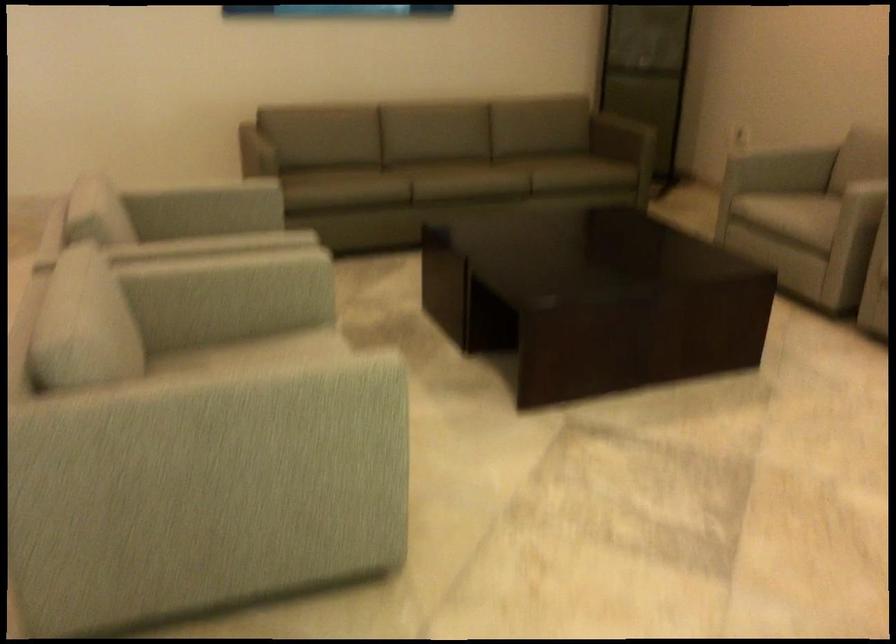
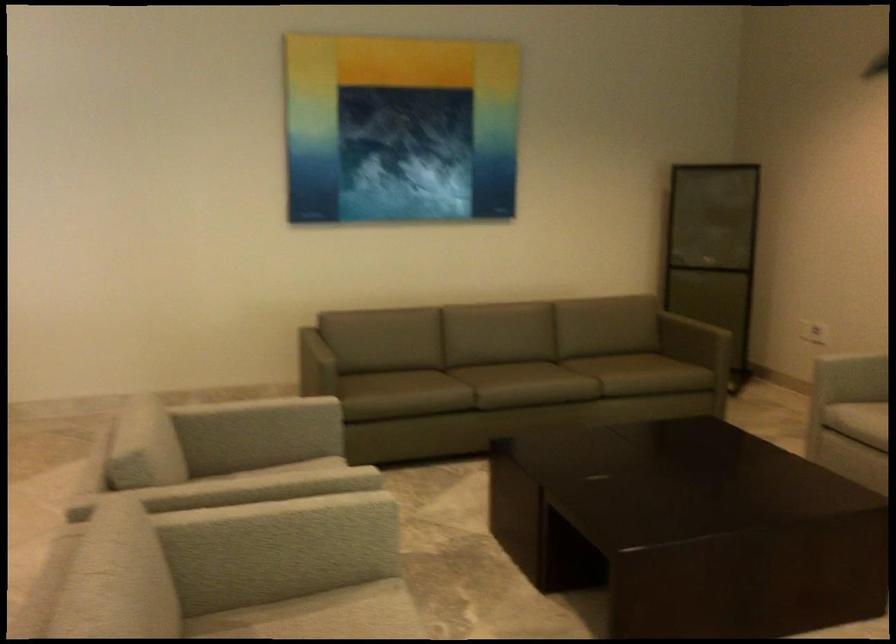
Where in the second image is the point corresponding to [256,140] from the first image?

(316, 345)